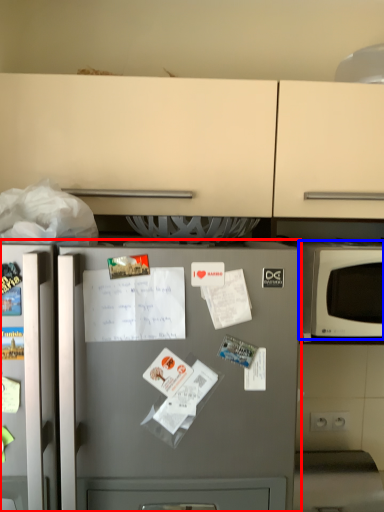
Question: Which point is closer to the camera, refrigerator (highlighted by a red box) or microwave oven (highlighted by a blue box)?

Choices:
 (A) refrigerator
 (B) microwave oven

Answer: (A)